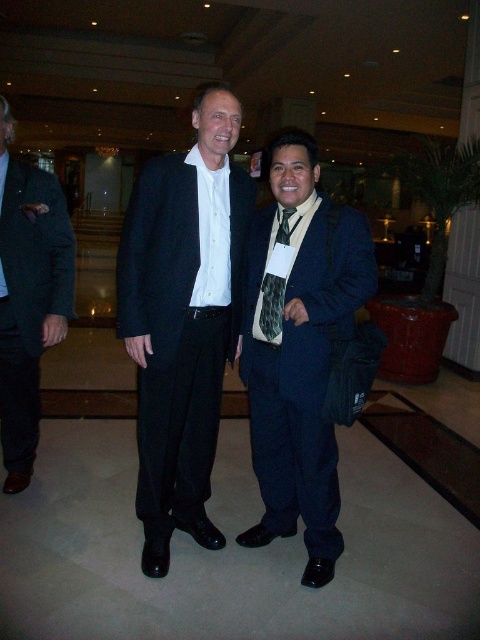
Question: Which point appears closest to the camera in this image?

Choices:
 (A) (156, 262)
 (B) (370, 244)
 (C) (269, 300)
 (D) (22, 282)

Answer: (B)

Question: Is matte black suit at center smaller than green textured tie at center?

Choices:
 (A) yes
 (B) no

Answer: (B)

Question: Which object is closer to the camera taking this photo?

Choices:
 (A) green textured tie at center
 (B) matte black suit at center

Answer: (B)

Question: Can you confirm if matte black suit at center is bigger than matte black suit at left?

Choices:
 (A) yes
 (B) no

Answer: (A)

Question: Among these points, which one is nearest to the camera?

Choices:
 (A) (286, 230)
 (B) (61, 246)

Answer: (A)

Question: Does matte black suit at center lie in front of green textured tie at center?

Choices:
 (A) yes
 (B) no

Answer: (A)